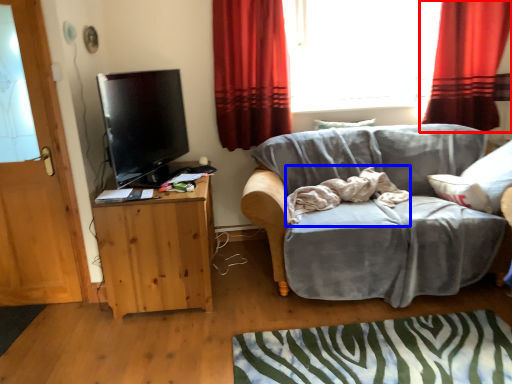
Question: Among these objects, which one is nearest to the camera, curtain (highlighted by a red box) or bedding (highlighted by a blue box)?

Choices:
 (A) curtain
 (B) bedding

Answer: (B)